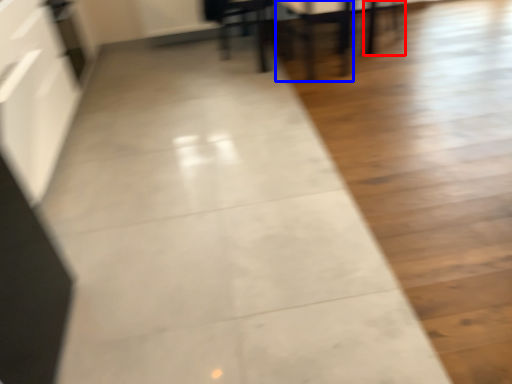
Question: Which object is closer to the camera taking this photo, chair (highlighted by a red box) or armchair (highlighted by a blue box)?

Choices:
 (A) chair
 (B) armchair

Answer: (B)